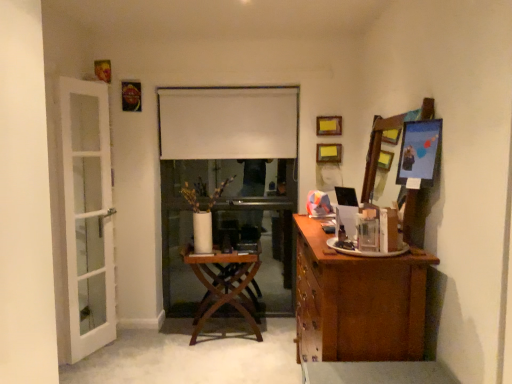
Measure the distance between point (333, 151) and camera.

11.19 feet.

This screenshot has height=384, width=512. What are the coordinates of `white matte curtain at center` in the screenshot? It's located at (227, 122).

How much space does metallic poster at upper center, arranged as the 2th picture frame when viewed from the left, occupy vertically?

metallic poster at upper center, arranged as the 2th picture frame when viewed from the left, is 9.82 inches in height.

Locate an element on the screen. This screenshot has width=512, height=384. metallic poster at upper center, arranged as the 2th picture frame when viewed from the left is located at coordinates (131, 96).

The image size is (512, 384). What are the coordinates of `white glass door at left` in the screenshot? It's located at (87, 215).

What do you see at coordinates (103, 70) in the screenshot?
I see `metallic gold picture frame at upper left, the fourth picture frame in the back-to-front sequence` at bounding box center [103, 70].

Identify the location of metallic gold picture frame at upper left, marked as the fifth picture frame in a bottom-to-top arrangement. This screenshot has height=384, width=512. pyautogui.click(x=103, y=70).

What do you see at coordinates (225, 286) in the screenshot?
I see `wooden table at center` at bounding box center [225, 286].

This screenshot has width=512, height=384. What do you see at coordinates (329, 125) in the screenshot? I see `wooden picture frame at upper center, the 4th picture frame from the front` at bounding box center [329, 125].

Find the location of a particular element. This screenshot has width=512, height=384. wooden picture frame at upper right, the fourth picture frame viewed from the top is located at coordinates (329, 153).

From the picture: Which of these two, wooden picture frame at upper center, acting as the 3th picture frame starting from the top, or metallic poster at upper center, which appears as the 3th picture frame when viewed from the back, is bigger?

metallic poster at upper center, which appears as the 3th picture frame when viewed from the back.

Which is behind, wooden picture frame at upper center, positioned as the third picture frame in bottom-to-top order, or metallic poster at upper center, arranged as the 2th picture frame when viewed from the left?

wooden picture frame at upper center, positioned as the third picture frame in bottom-to-top order, is more distant.

Between wooden picture frame at upper center, the 3th picture frame when ordered from left to right, and metallic poster at upper center, which appears as the 3th picture frame when viewed from the back, which one has more height?

metallic poster at upper center, which appears as the 3th picture frame when viewed from the back, is taller.

Between point (330, 119) and point (140, 92), which one is positioned behind?

Positioned behind is point (140, 92).

Considering the sizes of metallic silver picture frame at upper right, which appears as the 1th picture frame when ordered from the bottom, and wooden picture frame at upper right, the fourth picture frame when ordered from left to right, in the image, is metallic silver picture frame at upper right, which appears as the 1th picture frame when ordered from the bottom, wider or thinner than wooden picture frame at upper right, the fourth picture frame when ordered from left to right,?

metallic silver picture frame at upper right, which appears as the 1th picture frame when ordered from the bottom, is wider than wooden picture frame at upper right, the fourth picture frame when ordered from left to right.

From a real-world perspective, is metallic silver picture frame at upper right, which appears as the 1th picture frame when ordered from the bottom, physically located above or below wooden picture frame at upper right, the 2th picture frame positioned from the bottom?

In terms of real-world spatial position, metallic silver picture frame at upper right, which appears as the 1th picture frame when ordered from the bottom, is above wooden picture frame at upper right, the 2th picture frame positioned from the bottom.

Considering the relative sizes of metallic silver picture frame at upper right, which ranks as the 5th picture frame in left-to-right order, and wooden picture frame at upper right, which appears as the 5th picture frame when viewed from the front, in the image provided, is metallic silver picture frame at upper right, which ranks as the 5th picture frame in left-to-right order, shorter than wooden picture frame at upper right, which appears as the 5th picture frame when viewed from the front,?

Incorrect, the height of metallic silver picture frame at upper right, which ranks as the 5th picture frame in left-to-right order, does not fall short of that of wooden picture frame at upper right, which appears as the 5th picture frame when viewed from the front.

Is metallic silver picture frame at upper right, which ranks as the 5th picture frame in left-to-right order, closer to the viewer compared to wooden picture frame at upper right, the fourth picture frame viewed from the top?

Yes, it is in front of wooden picture frame at upper right, the fourth picture frame viewed from the top.

From the image's perspective, is wooden mirror at right below wooden picture frame at upper center, the 2th picture frame positioned from the back?

Yes, from the image's perspective, wooden mirror at right is beneath wooden picture frame at upper center, the 2th picture frame positioned from the back.

Is wooden picture frame at upper center, positioned as the third picture frame in bottom-to-top order, located within wooden mirror at right?

That's incorrect, wooden picture frame at upper center, positioned as the third picture frame in bottom-to-top order, is not inside wooden mirror at right.

From their relative heights in the image, would you say wooden mirror at right is taller or shorter than wooden picture frame at upper center, the 2th picture frame positioned from the back?

Considering their sizes, wooden mirror at right has more height than wooden picture frame at upper center, the 2th picture frame positioned from the back.

In the scene shown: What's the angular difference between wooden mirror at right and wooden picture frame at upper center, the 4th picture frame from the front,'s facing directions?

90 degrees.

How different are the orientations of wooden mirror at right and metallic poster at upper center, arranged as the 4th picture frame when viewed from the right, in degrees?

They differ by 90 degrees in their facing directions.

Does point (398, 115) lie behind point (128, 105)?

No, (398, 115) is closer to viewer.

From the image's perspective, is wooden mirror at right over metallic poster at upper center, arranged as the 2th picture frame when viewed from the left?

Actually, wooden mirror at right appears below metallic poster at upper center, arranged as the 2th picture frame when viewed from the left, in the image.

Does white glass door at left have a smaller size compared to metallic gold picture frame at upper left, marked as the fifth picture frame in a bottom-to-top arrangement?

Incorrect, white glass door at left is not smaller in size than metallic gold picture frame at upper left, marked as the fifth picture frame in a bottom-to-top arrangement.

Where is `door in front of the metallic gold picture frame at upper left, which appears as the first picture frame when viewed from the left`? door in front of the metallic gold picture frame at upper left, which appears as the first picture frame when viewed from the left is located at coordinates (87, 215).

Choose the correct answer: Is white glass door at left inside metallic gold picture frame at upper left, acting as the fifth picture frame starting from the right, or outside it?

white glass door at left exists outside the volume of metallic gold picture frame at upper left, acting as the fifth picture frame starting from the right.

From the image's perspective, is white glass door at left located beneath metallic gold picture frame at upper left, which appears as the first picture frame when viewed from the left?

Correct, white glass door at left appears lower than metallic gold picture frame at upper left, which appears as the first picture frame when viewed from the left, in the image.

Who is taller, wooden picture frame at upper right, the 2th picture frame positioned from the bottom, or metallic poster at upper center, which is the 3th picture frame from front to back?

metallic poster at upper center, which is the 3th picture frame from front to back, is taller.

From the picture: Is wooden picture frame at upper right, the fourth picture frame viewed from the top, facing towards metallic poster at upper center, arranged as the 4th picture frame when viewed from the right?

No, wooden picture frame at upper right, the fourth picture frame viewed from the top, does not turn towards metallic poster at upper center, arranged as the 4th picture frame when viewed from the right.

Choose the correct answer: Is wooden picture frame at upper right, marked as the first picture frame in a back-to-front arrangement, inside metallic poster at upper center, the 4th picture frame from the bottom, or outside it?

wooden picture frame at upper right, marked as the first picture frame in a back-to-front arrangement, is not inside metallic poster at upper center, the 4th picture frame from the bottom, it's outside.

Between point (321, 150) and point (137, 110), which one is positioned behind?

Point (137, 110)

Considering the relative positions of brown wood cabinet at right and wooden picture frame at upper right, which is the second picture frame from right to left, in the image provided, is brown wood cabinet at right to the left or to the right of wooden picture frame at upper right, which is the second picture frame from right to left,?

brown wood cabinet at right is to the left of wooden picture frame at upper right, which is the second picture frame from right to left.

From a real-world perspective, is brown wood cabinet at right located higher than wooden picture frame at upper right, the fourth picture frame when ordered from left to right?

No, from a real-world perspective, brown wood cabinet at right is not above wooden picture frame at upper right, the fourth picture frame when ordered from left to right.

Would you say brown wood cabinet at right is inside or outside wooden picture frame at upper right, which appears as the 5th picture frame when viewed from the front?

brown wood cabinet at right lies outside wooden picture frame at upper right, which appears as the 5th picture frame when viewed from the front.

Could you tell me if brown wood cabinet at right is turned towards wooden picture frame at upper right, the fourth picture frame when ordered from left to right?

No.

Identify the location of picture frame that is the 1st one when counting rightward from the metallic poster at upper center, the 4th picture frame from the bottom. The image size is (512, 384). (329, 125).

The image size is (512, 384). In order to click on the 4th picture frame in front of the wooden picture frame at upper right, the fourth picture frame when ordered from left to right, starting your count from the anchor in this screenshot , I will do point(419,151).

Estimate the real-world distances between objects in this image. Which object is further from brown wood cabinet at right, metallic silver picture frame at upper right, acting as the first picture frame starting from the front, or white matte curtain at center?

Among the two, white matte curtain at center is located further to brown wood cabinet at right.

Based on their spatial positions, is metallic poster at upper center, the 4th picture frame from the bottom, or white matte curtain at center closer to metallic gold picture frame at upper left, marked as the fifth picture frame in a bottom-to-top arrangement?

metallic poster at upper center, the 4th picture frame from the bottom, is closer to metallic gold picture frame at upper left, marked as the fifth picture frame in a bottom-to-top arrangement.

When comparing their distances from white matte curtain at center, does brown wood cabinet at right or wooden table at center seem closer?

Among the two, wooden table at center is located nearer to white matte curtain at center.

When comparing their distances from metallic silver picture frame at upper right, acting as the first picture frame starting from the front, does white glass door at left or metallic poster at upper center, the 4th picture frame from the bottom, seem further?

The object further to metallic silver picture frame at upper right, acting as the first picture frame starting from the front, is metallic poster at upper center, the 4th picture frame from the bottom.

Based on their spatial positions, is white matte curtain at center or wooden picture frame at upper center, acting as the 3th picture frame starting from the top, further from wooden table at center?

Based on the image, wooden picture frame at upper center, acting as the 3th picture frame starting from the top, appears to be further to wooden table at center.

Estimate the real-world distances between objects in this image. Which object is closer to white glass door at left, metallic poster at upper center, which appears as the 3th picture frame when viewed from the back, or wooden table at center?

metallic poster at upper center, which appears as the 3th picture frame when viewed from the back, lies closer to white glass door at left than the other object.

Based on the photo, which object lies nearer to the anchor point wooden table at center, brown wood cabinet at right or metallic silver picture frame at upper right, which ranks as the 5th picture frame in left-to-right order?

brown wood cabinet at right is closer to wooden table at center.

Considering their positions, is brown wood cabinet at right positioned further to metallic silver picture frame at upper right, the 5th picture frame from the top, than wooden table at center?

The object further to metallic silver picture frame at upper right, the 5th picture frame from the top, is wooden table at center.

Identify the location of curtain located between metallic gold picture frame at upper left, marked as the fifth picture frame in a bottom-to-top arrangement, and wooden picture frame at upper center, the 3th picture frame when ordered from left to right, in the left-right direction. (227, 122).

You are a GUI agent. You are given a task and a screenshot of the screen. Output one action in this format:
    pyautogui.click(x=<x>, y=<y>)
    Task: Click on the cabinetry between metallic gold picture frame at upper left, which appears as the first picture frame when viewed from the left, and wooden table at center vertically
    The height and width of the screenshot is (384, 512).
    Given the screenshot: What is the action you would take?
    point(357,302)

This screenshot has width=512, height=384. Find the location of `picture frame located between metallic poster at upper center, which is the 3th picture frame from front to back, and wooden picture frame at upper right, the fourth picture frame when ordered from left to right, in the left-right direction`. picture frame located between metallic poster at upper center, which is the 3th picture frame from front to back, and wooden picture frame at upper right, the fourth picture frame when ordered from left to right, in the left-right direction is located at coordinates (329, 125).

Image resolution: width=512 pixels, height=384 pixels. I want to click on desk between brown wood cabinet at right and white matte curtain at center along the z-axis, so click(x=225, y=286).